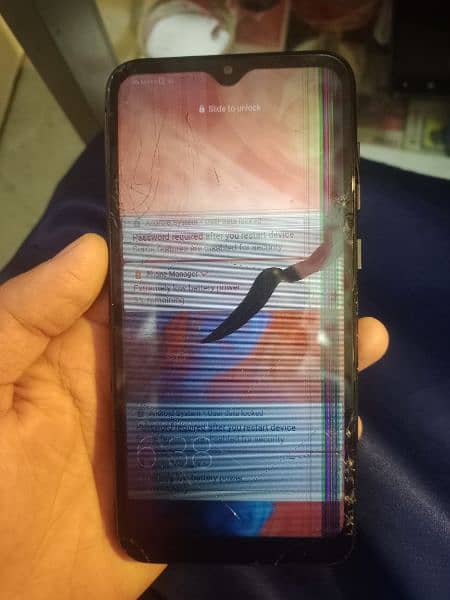
Locate an element on the screen. This screenshot has height=600, width=450. leg of a table is located at coordinates (76, 54).